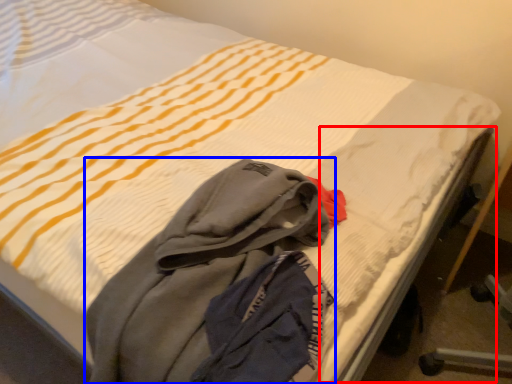
Question: Which of the following is the farthest to the observer, bed frame (highlighted by a red box) or laundry (highlighted by a blue box)?

Choices:
 (A) bed frame
 (B) laundry

Answer: (A)